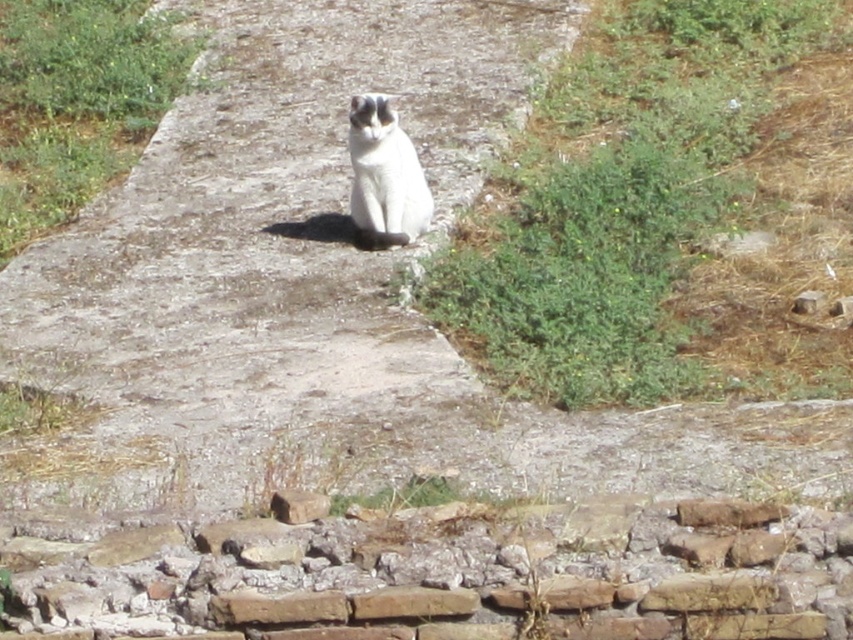
You are a photographer trying to capture the white fur cat at center and the rusty brick wall at lower center in a single frame. Based on their sizes, which object would appear wider in the photo?

The rusty brick wall at lower center would appear wider in the photo since its width surpasses that of the white fur cat at center.

You are standing on the stone pathway where the white cat is sitting. You want to walk to the rusty brick wall at lower center marked by point (x=451, y=577). Which direction should you go from your current position?

The rusty brick wall at lower center is located at point (x=451, y=577), so you should move towards the lower center direction from your current position on the stone pathway where the white cat is sitting.

You are a photographer trying to capture the white fur cat at center. The rusty brick wall at lower center is in the background. Will the wall be taller than the cat in the photo?

The rusty brick wall at lower center is not as tall as white fur cat at center, so the wall will appear shorter than the cat in the photo.